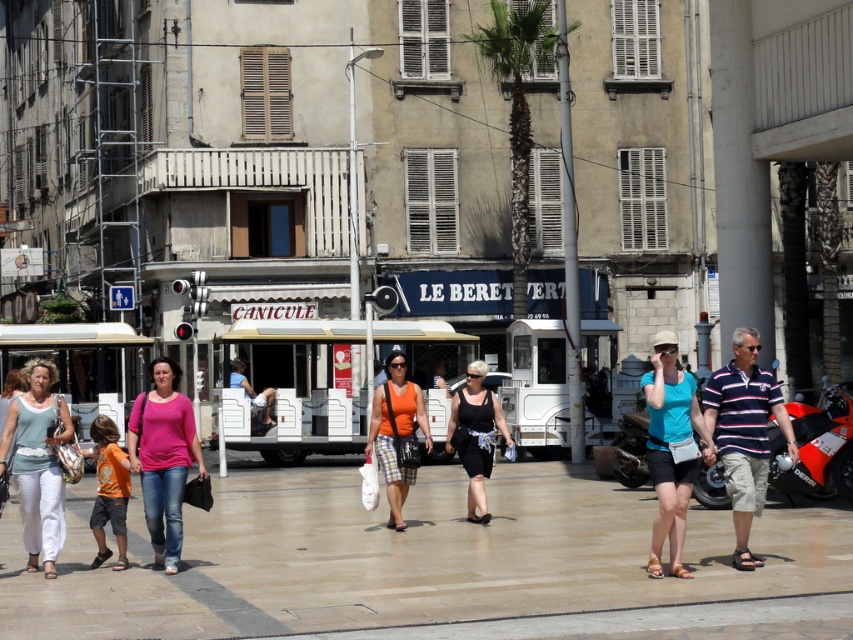
Question: Can you confirm if striped cotton polo shirt at center-right is smaller than matte white pants at lower left?

Choices:
 (A) no
 (B) yes

Answer: (B)

Question: Which of the following is the farthest from the observer?

Choices:
 (A) (666, 497)
 (B) (41, 524)
 (C) (146, 458)
 (D) (590, 524)

Answer: (D)

Question: Among these points, which one is farthest from the camera?

Choices:
 (A) (321, 493)
 (B) (405, 368)

Answer: (A)

Question: Does blue matte tank top at center appear on the left side of orange shirt at center?

Choices:
 (A) yes
 (B) no

Answer: (B)

Question: Can you confirm if matte white pants at lower left is thinner than orange fabric bag at center?

Choices:
 (A) no
 (B) yes

Answer: (A)

Question: Considering the real-world distances, which object is closest to the black matte dress at center?

Choices:
 (A) pink cotton shirt at center
 (B) orange fabric bag at center
 (C) striped cotton polo shirt at center-right
 (D) blue matte tank top at center

Answer: (B)